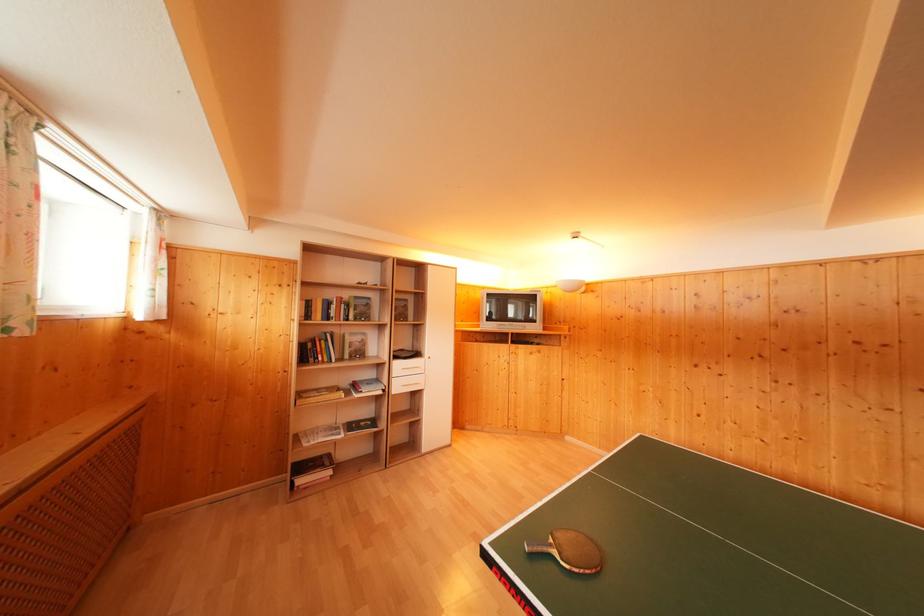
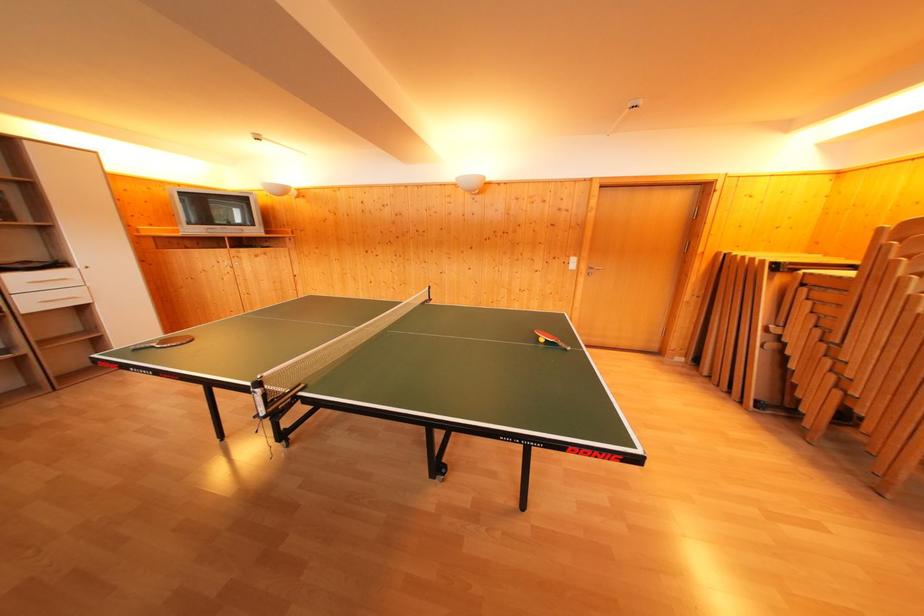
Find the pixel in the second image that matches point 421,360 in the first image.

(64, 270)